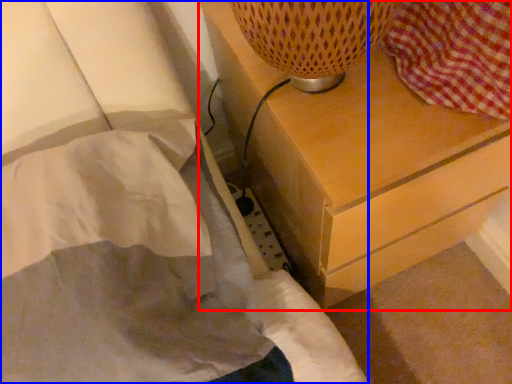
Question: Which object appears farthest to the camera in this image, chest of drawers (highlighted by a red box) or bed (highlighted by a blue box)?

Choices:
 (A) chest of drawers
 (B) bed

Answer: (A)